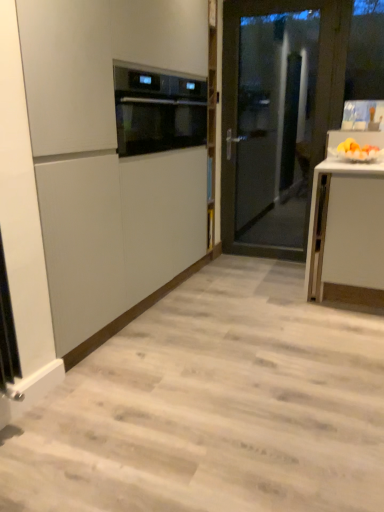
What do you see at coordinates (110, 162) in the screenshot? The width and height of the screenshot is (384, 512). I see `matte white cabinet at center` at bounding box center [110, 162].

Image resolution: width=384 pixels, height=512 pixels. In order to click on matte white cabinet at center in this screenshot , I will do `click(110, 162)`.

Does satin black oven at upper center come behind yellow matte fruit at right?

Yes, it is behind yellow matte fruit at right.

Can you see satin black oven at upper center touching yellow matte fruit at right?

There is a gap between satin black oven at upper center and yellow matte fruit at right.

What's the angular difference between satin black oven at upper center and yellow matte fruit at right's facing directions?

satin black oven at upper center and yellow matte fruit at right are facing 89.7 degrees away from each other.

From the image's perspective, is satin black oven at upper center above yellow matte fruit at right?

Yes.

Is transparent glass door at center at the left side of matte white cabinet at center?

No.

Is point (229, 91) farther from viewer compared to point (183, 160)?

Yes, it is behind point (183, 160).

From the image's perspective, is transparent glass door at center over matte white cabinet at center?

Indeed, from the image's perspective, transparent glass door at center is shown above matte white cabinet at center.

The width and height of the screenshot is (384, 512). Find the location of `cabinetry that appears above the transparent glass door at center (from a real-world perspective)`. cabinetry that appears above the transparent glass door at center (from a real-world perspective) is located at coordinates (110, 162).

Could you tell me if satin black oven at upper center is facing transparent glass door at center?

No, satin black oven at upper center is not facing towards transparent glass door at center.

Is transparent glass door at center a part of satin black oven at upper center?

Actually, transparent glass door at center is outside satin black oven at upper center.

In the image, is satin black oven at upper center positioned in front of or behind transparent glass door at center?

Visually, satin black oven at upper center is located in front of transparent glass door at center.

Between satin black oven at upper center and transparent glass door at center, which one has smaller size?

With smaller size is satin black oven at upper center.

Between satin black oven at upper center and matte white cabinet at center, which one appears on the right side from the viewer's perspective?

From the viewer's perspective, satin black oven at upper center appears more on the right side.

Between satin black oven at upper center and matte white cabinet at center, which one is positioned in front?

matte white cabinet at center is in front.

Between satin black oven at upper center and matte white cabinet at center, which one has less height?

satin black oven at upper center is shorter.

Which of these two, yellow matte fruit at right or satin black oven at upper center, stands taller?

satin black oven at upper center is taller.

From a real-world perspective, between yellow matte fruit at right and satin black oven at upper center, who is vertically higher?

In real-world perspective, satin black oven at upper center is above.

Which object is positioned more to the left, yellow matte fruit at right or satin black oven at upper center?

From the viewer's perspective, satin black oven at upper center appears more on the left side.

Can you tell me how much yellow matte fruit at right and satin black oven at upper center differ in facing direction?

The angular difference between yellow matte fruit at right and satin black oven at upper center is 89.7 degrees.

Is matte white cabinet at center smaller than satin black oven at upper center?

No, matte white cabinet at center is not smaller than satin black oven at upper center.

Is matte white cabinet at center with satin black oven at upper center?

No, matte white cabinet at center is not with satin black oven at upper center.

From a real-world perspective, relative to satin black oven at upper center, is matte white cabinet at center vertically above or below?

matte white cabinet at center is situated lower than satin black oven at upper center in the real world.

This screenshot has width=384, height=512. In the image, there is a yellow matte fruit at right. Find the location of `cabinetry below it (from the image's perspective)`. cabinetry below it (from the image's perspective) is located at coordinates (110, 162).

Is yellow matte fruit at right at the back of matte white cabinet at center?

matte white cabinet at center does not have its back to yellow matte fruit at right.

From a real-world perspective, who is located lower, matte white cabinet at center or yellow matte fruit at right?

yellow matte fruit at right.

Can you confirm if matte white cabinet at center is positioned to the left of yellow matte fruit at right?

Yes, matte white cabinet at center is to the left of yellow matte fruit at right.

Locate an element on the screen. Image resolution: width=384 pixels, height=512 pixels. kitchen appliance on the left of the yellow matte fruit at right is located at coordinates (158, 111).

There is a transparent glass door at center. Find the location of `cabinetry above it (from a real-world perspective)`. cabinetry above it (from a real-world perspective) is located at coordinates (110, 162).

Which object lies further to the anchor point matte white cabinet at center, transparent glass door at center or yellow matte fruit at right?

Among the two, yellow matte fruit at right is located further to matte white cabinet at center.

Looking at this image, when comparing their distances from matte white cabinet at center, does yellow matte fruit at right or transparent glass door at center seem closer?

transparent glass door at center is positioned closer to the anchor matte white cabinet at center.

From the picture: Considering their positions, is yellow matte fruit at right positioned further to transparent glass door at center than satin black oven at upper center?

The object further to transparent glass door at center is yellow matte fruit at right.

Looking at the image, which one is located closer to yellow matte fruit at right, matte white cabinet at center or satin black oven at upper center?

Among the two, satin black oven at upper center is located nearer to yellow matte fruit at right.

When comparing their distances from yellow matte fruit at right, does satin black oven at upper center or matte white cabinet at center seem further?

matte white cabinet at center is further to yellow matte fruit at right.

From the image, which object appears to be farther from matte white cabinet at center, satin black oven at upper center or yellow matte fruit at right?

Among the two, yellow matte fruit at right is located further to matte white cabinet at center.

From the image, which object appears to be nearer to yellow matte fruit at right, transparent glass door at center or matte white cabinet at center?

The object closer to yellow matte fruit at right is transparent glass door at center.

From the image, which object appears to be nearer to transparent glass door at center, matte white cabinet at center or satin black oven at upper center?

Based on the image, satin black oven at upper center appears to be nearer to transparent glass door at center.

Identify the location of fruit located between matte white cabinet at center and transparent glass door at center in the depth direction. The image size is (384, 512). (358, 151).

Find the location of `door situated between satin black oven at upper center and yellow matte fruit at right from left to right`. door situated between satin black oven at upper center and yellow matte fruit at right from left to right is located at coordinates (277, 118).

Locate an element on the screen. This screenshot has height=512, width=384. kitchen appliance situated between matte white cabinet at center and yellow matte fruit at right from left to right is located at coordinates (158, 111).

Find the location of a particular element. kitchen appliance between matte white cabinet at center and transparent glass door at center in the front-back direction is located at coordinates (158, 111).